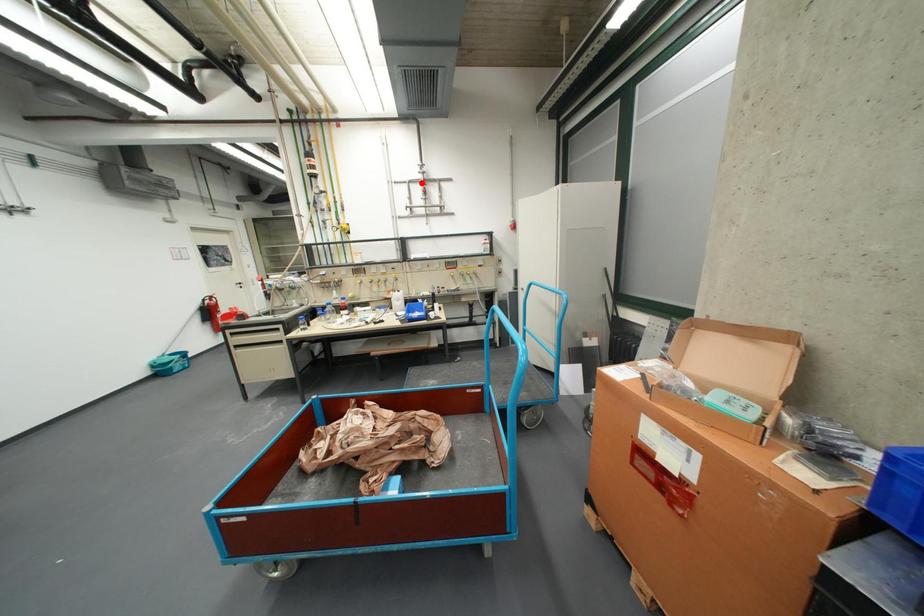
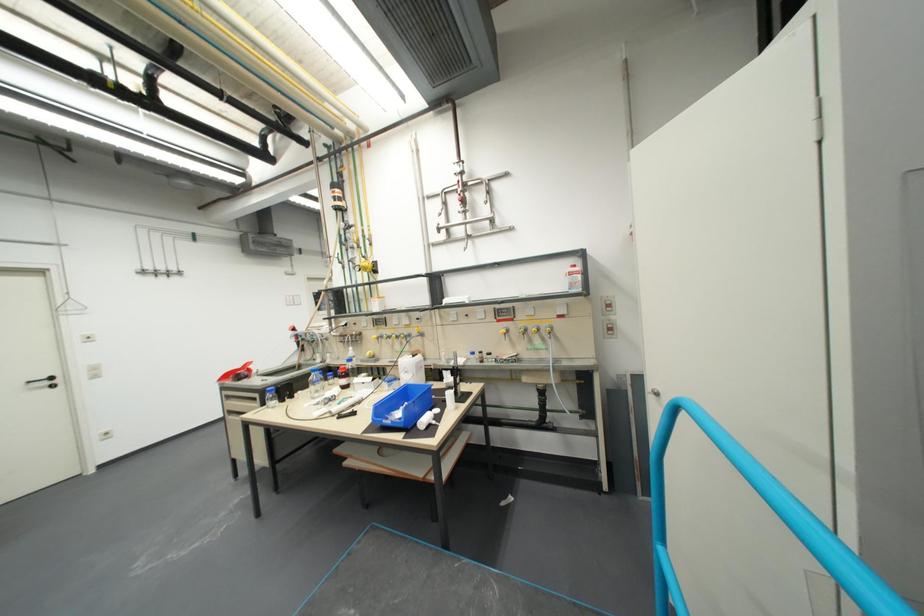
In the second image, find the point that corresponds to the highlighted location in the first image.

(457, 193)